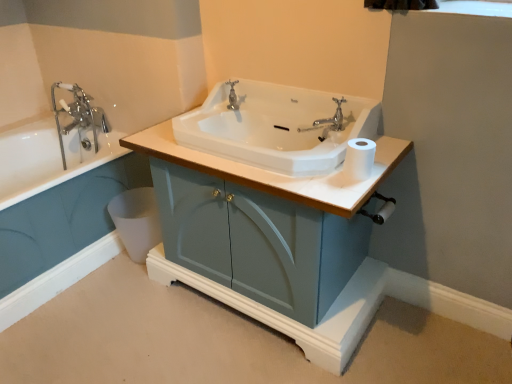
Image resolution: width=512 pixels, height=384 pixels. Identify the location of spots to the right of polished chrome faucet at center. (267, 113).